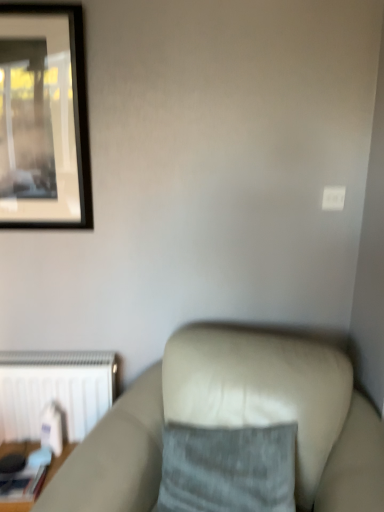
Question: Does suede-like beige couch at lower right have a greater width compared to white matte radiator at lower left?

Choices:
 (A) no
 (B) yes

Answer: (B)

Question: Is suede-like beige couch at lower right thinner than white matte radiator at lower left?

Choices:
 (A) yes
 (B) no

Answer: (B)

Question: Does suede-like beige couch at lower right have a larger size compared to white matte radiator at lower left?

Choices:
 (A) no
 (B) yes

Answer: (B)

Question: Does suede-like beige couch at lower right appear on the right side of white matte radiator at lower left?

Choices:
 (A) yes
 (B) no

Answer: (A)

Question: Is suede-like beige couch at lower right positioned in front of white matte radiator at lower left?

Choices:
 (A) yes
 (B) no

Answer: (A)

Question: In terms of height, does wooden table at lower left look taller or shorter compared to suede-like beige couch at lower right?

Choices:
 (A) short
 (B) tall

Answer: (A)

Question: From the image's perspective, is wooden table at lower left positioned above or below suede-like beige couch at lower right?

Choices:
 (A) below
 (B) above

Answer: (A)

Question: From a real-world perspective, relative to suede-like beige couch at lower right, is wooden table at lower left vertically above or below?

Choices:
 (A) below
 (B) above

Answer: (A)

Question: In terms of size, does wooden table at lower left appear bigger or smaller than suede-like beige couch at lower right?

Choices:
 (A) small
 (B) big

Answer: (A)

Question: Is point (29, 403) positioned closer to the camera than point (279, 463)?

Choices:
 (A) farther
 (B) closer

Answer: (A)

Question: From a real-world perspective, is white matte radiator at lower left physically located above or below gray fabric pillow at center?

Choices:
 (A) below
 (B) above

Answer: (A)

Question: Visually, is white matte radiator at lower left positioned to the left or to the right of gray fabric pillow at center?

Choices:
 (A) right
 (B) left

Answer: (B)

Question: Looking at the image, does white matte radiator at lower left seem bigger or smaller compared to gray fabric pillow at center?

Choices:
 (A) big
 (B) small

Answer: (B)

Question: From a real-world perspective, is gray fabric pillow at center physically located above or below white matte radiator at lower left?

Choices:
 (A) below
 (B) above

Answer: (B)

Question: Does point (192, 492) appear closer or farther from the camera than point (43, 386)?

Choices:
 (A) closer
 (B) farther

Answer: (A)